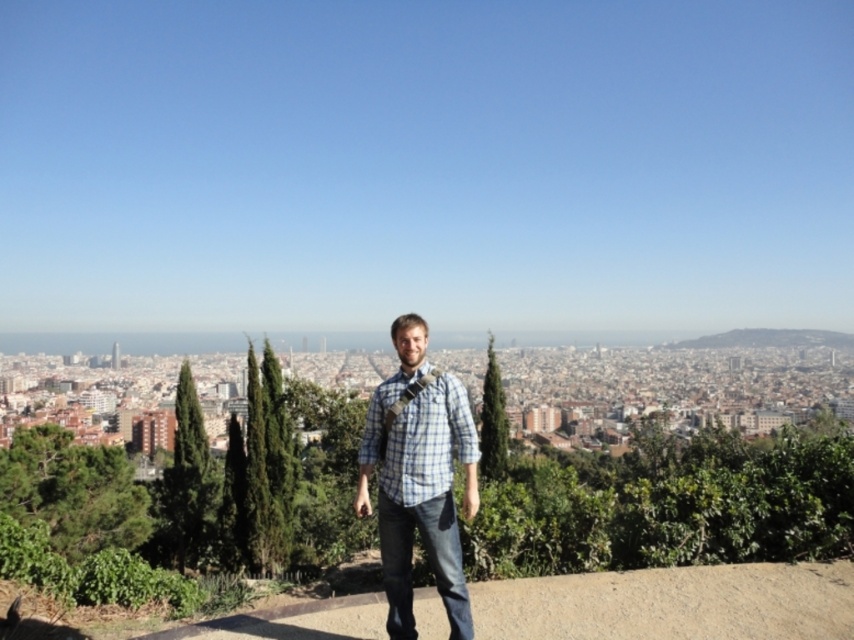
Who is positioned more to the left, blue plaid shirt at center or plaid fabric shirt at center?

blue plaid shirt at center

Measure the distance between blue plaid shirt at center and camera.

blue plaid shirt at center is 388.30 meters from camera.

You are a GUI agent. You are given a task and a screenshot of the screen. Output one action in this format:
    pyautogui.click(x=<x>, y=<y>)
    Task: Click on the blue plaid shirt at center
    This screenshot has width=854, height=640.
    Given the screenshot: What is the action you would take?
    pyautogui.click(x=419, y=481)